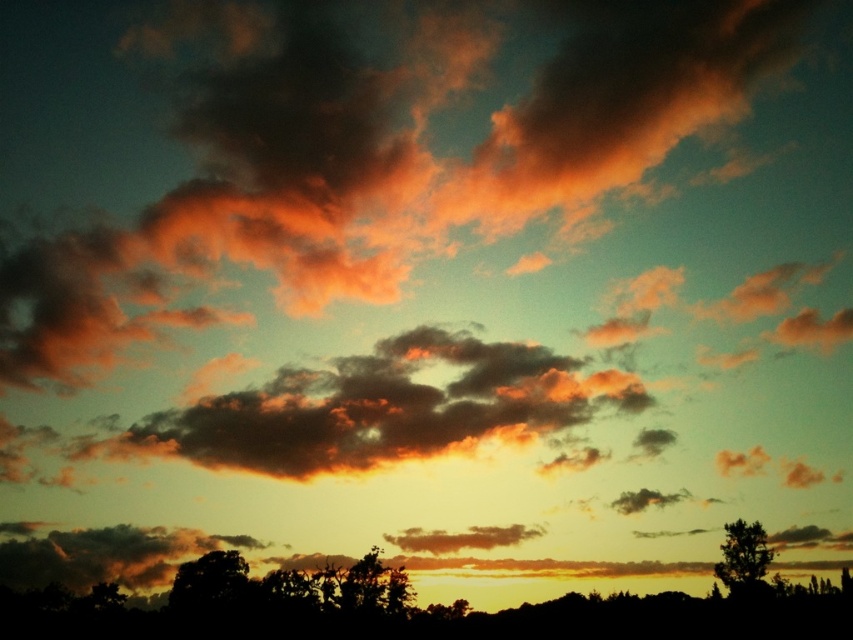
Question: Does silhouette tree at lower right have a greater width compared to matte orange cloud at center?

Choices:
 (A) no
 (B) yes

Answer: (A)

Question: Is silhouette tree at lower right below matte orange cloud at center?

Choices:
 (A) no
 (B) yes

Answer: (A)

Question: Which of the following is the farthest from the observer?

Choices:
 (A) matte orange cloud at center
 (B) silhouette tree at lower right

Answer: (A)

Question: Can you confirm if silhouette tree at lower right is bigger than matte orange cloud at center?

Choices:
 (A) no
 (B) yes

Answer: (B)

Question: Among these points, which one is nearest to the camera?

Choices:
 (A) (733, 529)
 (B) (489, 540)

Answer: (A)

Question: Among these objects, which one is farthest from the camera?

Choices:
 (A) silhouette tree at lower right
 (B) matte orange cloud at center

Answer: (B)